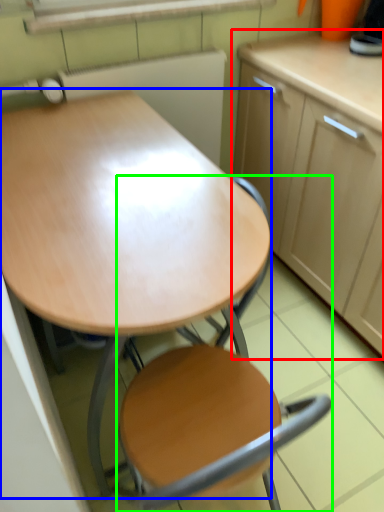
Question: Estimate the real-world distances between objects in this image. Which object is closer to cabinetry (highlighted by a red box), desk (highlighted by a blue box) or chair (highlighted by a green box)?

Choices:
 (A) desk
 (B) chair

Answer: (A)